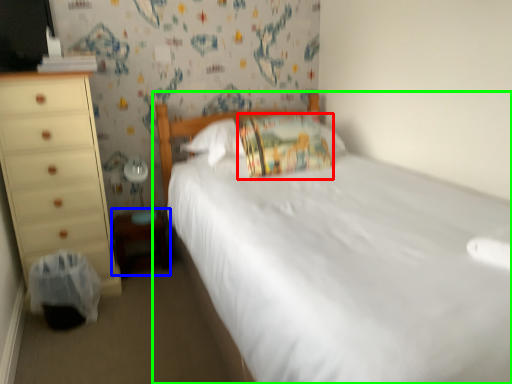
Question: Which object is the closest to the pillow (highlighted by a red box)? Choose among these: changing table (highlighted by a blue box) or bed (highlighted by a green box).

Choices:
 (A) changing table
 (B) bed

Answer: (B)